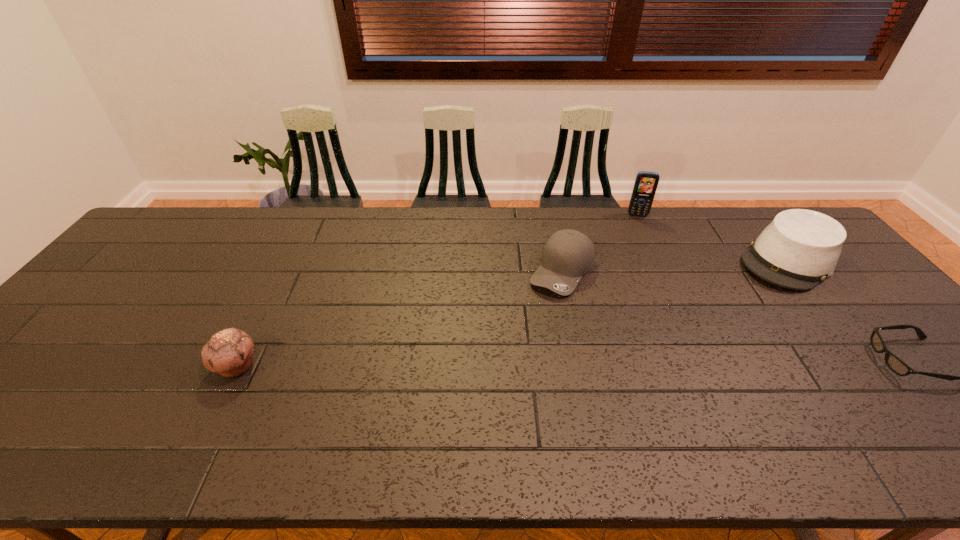
Find the location of a particular element. vacant space located on the front brim of the baseball cap is located at coordinates (510, 369).

Locate an element on the screen. free space located on the front brim of the baseball cap is located at coordinates (526, 340).

Locate an element on the screen. free space located 0.390m on the front brim of the baseball cap is located at coordinates (490, 406).

Where is `vacant point located 0.050m on the screen of the tallest object`? Image resolution: width=960 pixels, height=540 pixels. vacant point located 0.050m on the screen of the tallest object is located at coordinates (637, 226).

Where is `free space located 0.280m on the screen of the tallest object`? Image resolution: width=960 pixels, height=540 pixels. free space located 0.280m on the screen of the tallest object is located at coordinates (641, 269).

At what (x,y) coordinates should I click in order to perform the action: click on free location located on the screen of the tallest object. Please return your answer as a coordinate pair (x, y). Looking at the image, I should click on (641, 263).

You are a GUI agent. You are given a task and a screenshot of the screen. Output one action in this format:
    pyautogui.click(x=<x>, y=<y>)
    Task: Click on the hat located at the far edge
    This screenshot has width=960, height=540.
    Given the screenshot: What is the action you would take?
    pyautogui.click(x=800, y=248)

Where is `baseball cap that is at the far edge`? The image size is (960, 540). baseball cap that is at the far edge is located at coordinates (568, 254).

Find the location of a particular element. This screenshot has width=960, height=540. cellular telephone at the far edge is located at coordinates (646, 182).

Identify the location of object located at the near edge. The width and height of the screenshot is (960, 540). point(229,352).